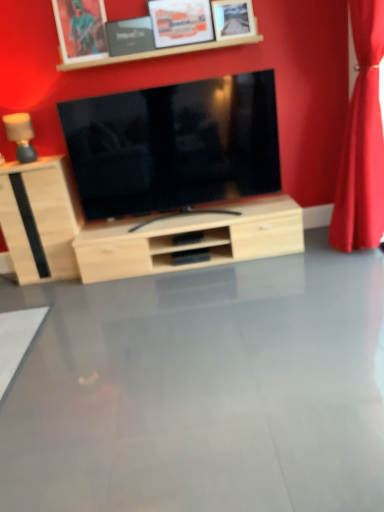
The height and width of the screenshot is (512, 384). What are the coordinates of `vacant area on top of light wood cabinet at left (from a real-world perspective)` in the screenshot? It's located at (33, 159).